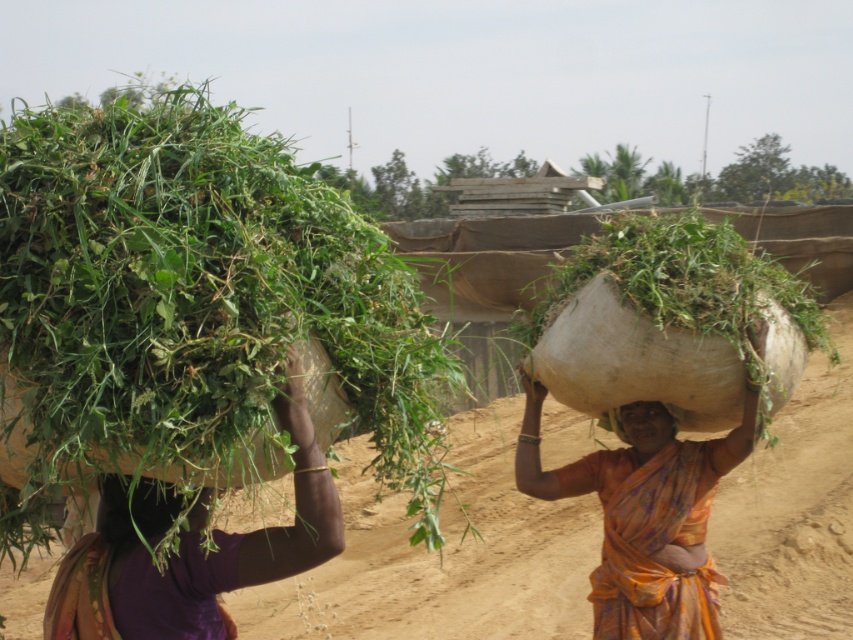
Question: Is brown sandy dirt at center below green leafy material at upper left?

Choices:
 (A) yes
 (B) no

Answer: (A)

Question: Considering the real-world distances, which object is farthest from the green leafy hay at upper left?

Choices:
 (A) matte brown head at center
 (B) brown sandy dirt at center
 (C) matte brown basket at left

Answer: (B)

Question: Is matte brown basket at left above orange floral sari at center?

Choices:
 (A) no
 (B) yes

Answer: (B)

Question: Which of the following is the closest to the observer?

Choices:
 (A) brown sandy dirt at center
 (B) green leafy hay at upper left
 (C) orange floral sari at center
 (D) matte brown basket at left

Answer: (B)

Question: Does green leafy hay at upper left appear over matte brown head at center?

Choices:
 (A) yes
 (B) no

Answer: (A)

Question: Among these points, which one is farthest from the camera?

Choices:
 (A) (277, 620)
 (B) (184, 508)
 (C) (672, 280)

Answer: (A)